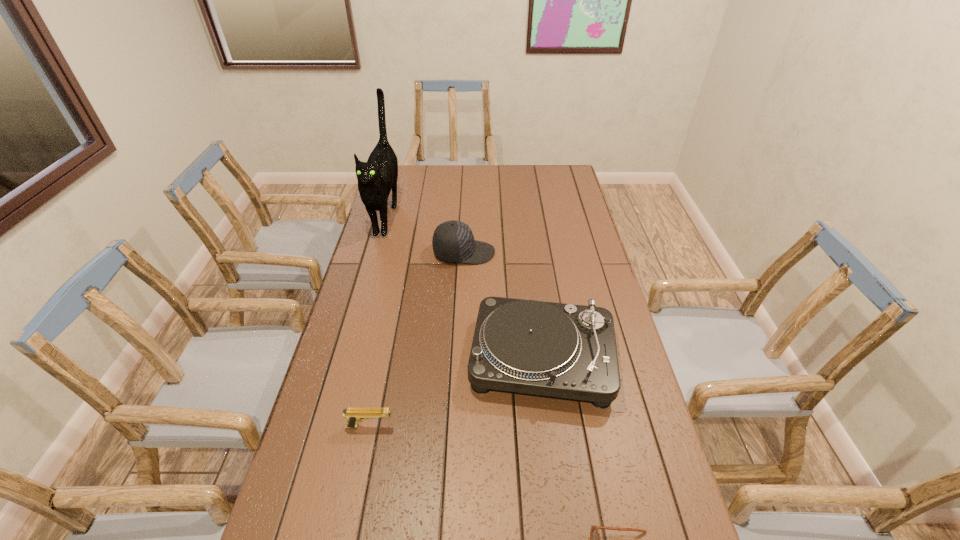
Identify the location of free space between the fourth farthest object and the third farthest object. (456, 393).

Where is `vacant space that is in between the pistol and the cat`? Image resolution: width=960 pixels, height=540 pixels. vacant space that is in between the pistol and the cat is located at coordinates (378, 321).

The image size is (960, 540). I want to click on free space between the second nearest object and the third farthest object, so click(456, 393).

Identify the location of object that is the closest to the tallest object. The height and width of the screenshot is (540, 960). (453, 241).

Locate an element on the screen. This screenshot has width=960, height=540. the third closest object to the baseball cap is located at coordinates (353, 415).

Where is `vacant space that satisfies the following two spatial constraints: 1. on the face of the third farthest object; 2. on the right side of the tallest object`? vacant space that satisfies the following two spatial constraints: 1. on the face of the third farthest object; 2. on the right side of the tallest object is located at coordinates (347, 359).

This screenshot has width=960, height=540. What are the coordinates of `blank area in the image that satisfies the following two spatial constraints: 1. at the front of the third farthest object where the brim is located; 2. on the left side of the baseball cap` in the screenshot? It's located at (460, 359).